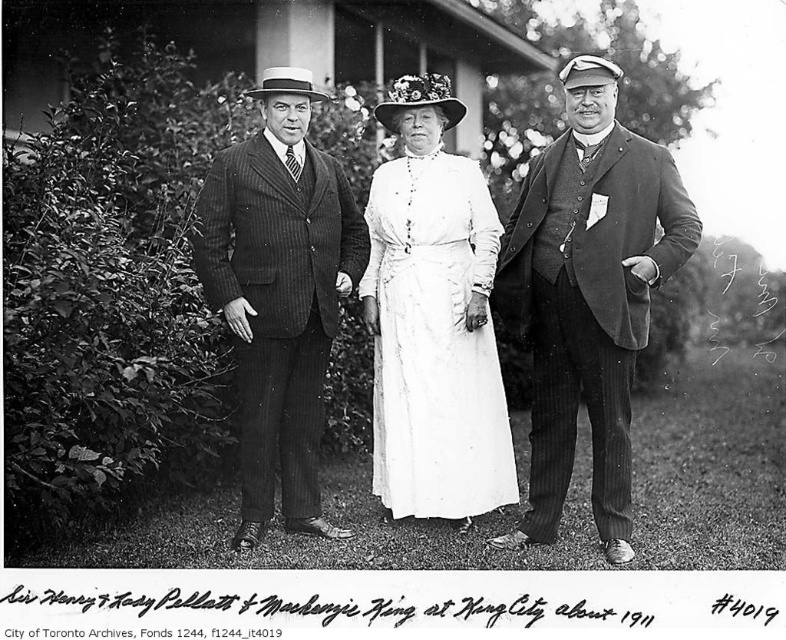
Who is more forward, (507, 284) or (527, 492)?

Positioned in front is point (507, 284).

What do you see at coordinates (516, 298) in the screenshot? This screenshot has width=786, height=640. I see `matte black suit at center` at bounding box center [516, 298].

Find the location of a particular element. matte black suit at center is located at coordinates (516, 298).

Is pinstriped suit at center to the right of white cotton dress at center from the viewer's perspective?

In fact, pinstriped suit at center is to the left of white cotton dress at center.

Is pinstriped suit at center to the left of white cotton dress at center from the viewer's perspective?

Correct, you'll find pinstriped suit at center to the left of white cotton dress at center.

What are the coordinates of `pinstriped suit at center` in the screenshot? It's located at (278, 294).

Is smooth dark suit at center further to camera compared to white cotton dress at center?

No, it is in front of white cotton dress at center.

Does smooth dark suit at center have a lesser width compared to white cotton dress at center?

Incorrect, smooth dark suit at center's width is not less than white cotton dress at center's.

Who is more forward, (520, 320) or (421, 500)?

Point (520, 320) is in front.

Identify the location of smooth dark suit at center. pos(586,296).